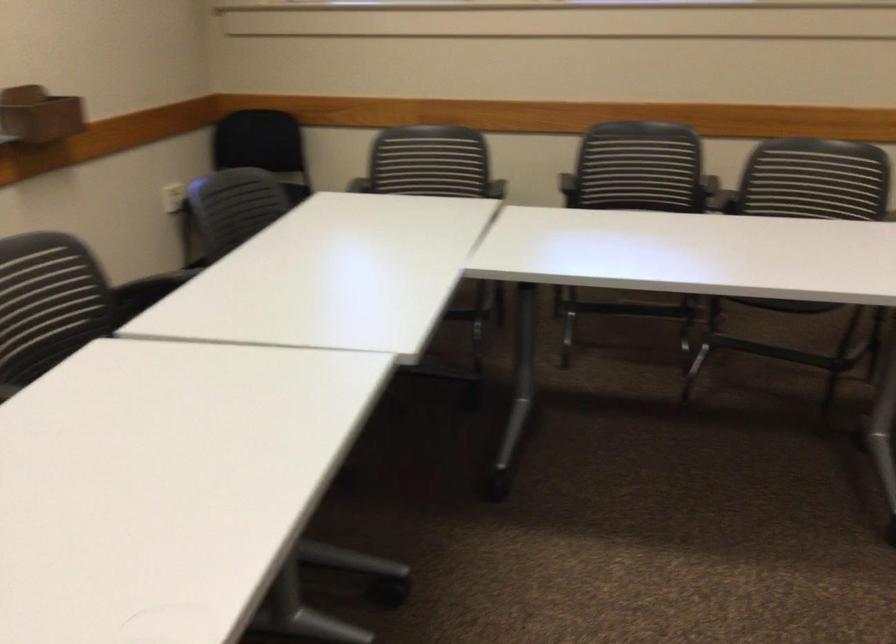
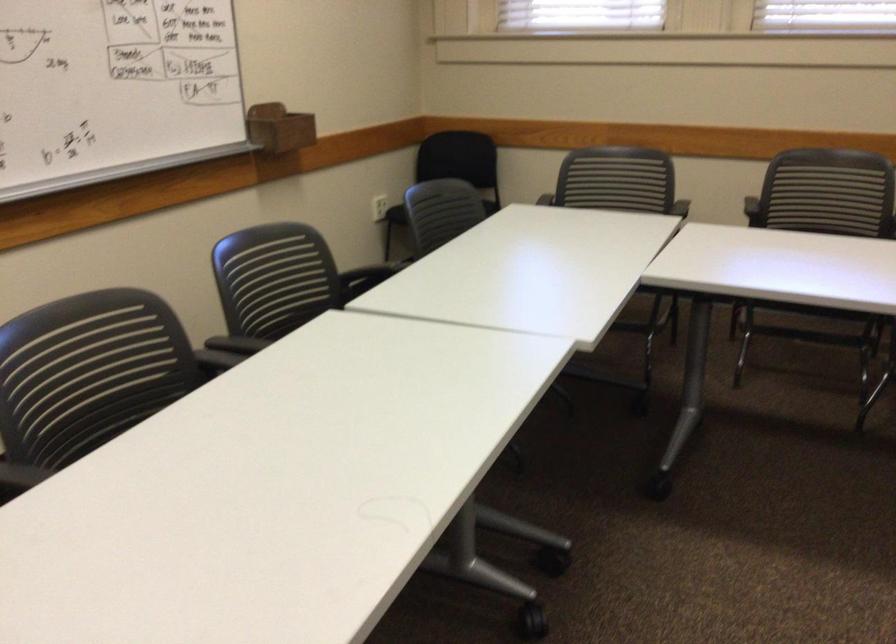
Locate, in the second image, the point that corresponds to point (352, 156) in the first image.

(532, 175)